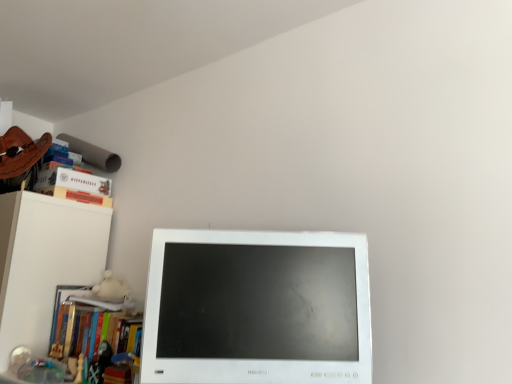
Question: Does point (112, 205) appear closer or farther from the camera than point (218, 319)?

Choices:
 (A) closer
 (B) farther

Answer: (B)

Question: Is hardcover book at upper left, which is counted as the second paperback book, starting from the top, inside or outside of white glossy computer monitor at center?

Choices:
 (A) inside
 (B) outside

Answer: (B)

Question: Based on their relative distances, which object is farther from the hardcover book at left, the first book from the bottom?

Choices:
 (A) white glossy computer monitor at center
 (B) wooden chess piece at lower left
 (C) white matte book at lower left, arranged as the first book when viewed from the top
 (D) hardcover book at upper left, which is counted as the first paperback book, starting from the bottom
 (E) hardcover book at upper left, the 1th paperback book viewed from the top

Answer: (E)

Question: Considering the real-world distances, which object is farthest from the hardcover book at upper left, the 1th paperback book viewed from the top?

Choices:
 (A) hardcover book at upper left, which is counted as the first paperback book, starting from the bottom
 (B) white glossy computer monitor at center
 (C) hardcover book at left, which is the second book in top-to-bottom order
 (D) white matte book at lower left, arranged as the first book when viewed from the top
 (E) wooden chess piece at lower left

Answer: (B)